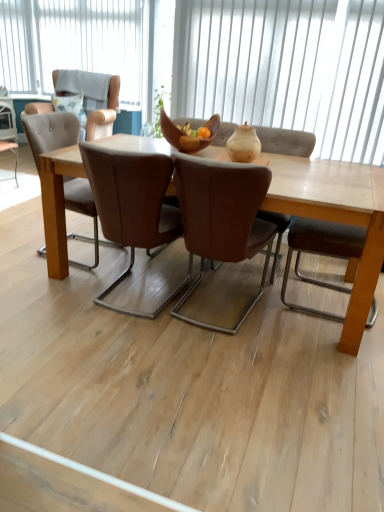
At what (x,y) coordinates should I click in order to perform the action: click on free space behind brown leather chair at center, the 2th chair positioned from the right. Please return your answer as a coordinate pair (x, y). This screenshot has width=384, height=512. Looking at the image, I should click on (152, 258).